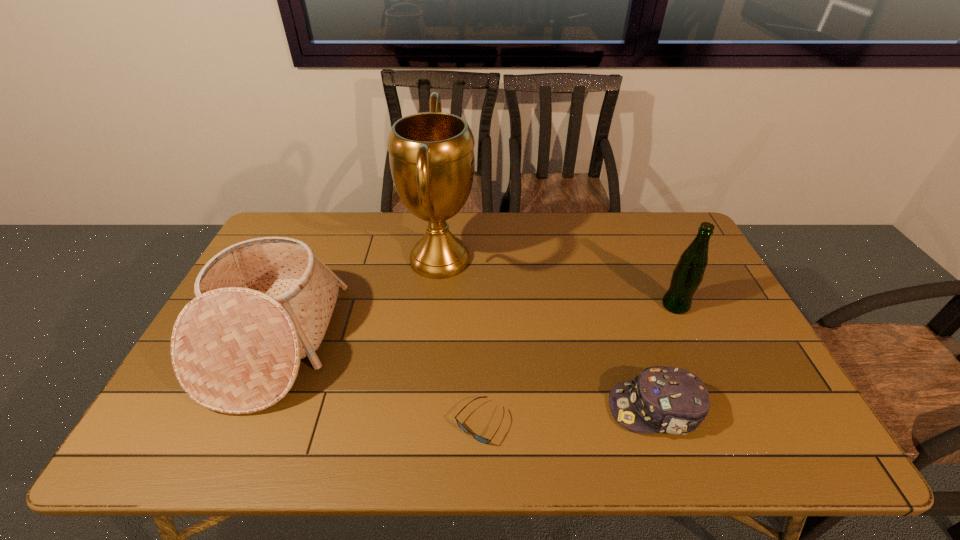
Where is `vacant area at the left edge`? The height and width of the screenshot is (540, 960). vacant area at the left edge is located at coordinates (182, 397).

The width and height of the screenshot is (960, 540). In the image, there is a desktop. What are the coordinates of `vacant space at the right edge` in the screenshot? It's located at (704, 322).

In the image, there is a desktop. Identify the location of free space at the far left corner. (x=309, y=223).

This screenshot has width=960, height=540. In order to click on free spot at the far right corner of the desktop in this screenshot , I will do `click(684, 229)`.

The image size is (960, 540). I want to click on vacant area that lies between the fourth tallest object and the leftmost object, so click(464, 376).

Where is `free space between the sunglasses and the beer bottle`? free space between the sunglasses and the beer bottle is located at coordinates [x=578, y=364].

Where is `vacant space that's between the headwear and the sunglasses`? This screenshot has width=960, height=540. vacant space that's between the headwear and the sunglasses is located at coordinates (567, 416).

Identify the location of free spot between the basket and the fourth object from left to right. (464, 376).

Where is `vacant area that lies between the tallest object and the basket`? Image resolution: width=960 pixels, height=540 pixels. vacant area that lies between the tallest object and the basket is located at coordinates (356, 301).

Locate an element on the screen. The height and width of the screenshot is (540, 960). vacant area that lies between the shortest object and the fourth tallest object is located at coordinates (567, 416).